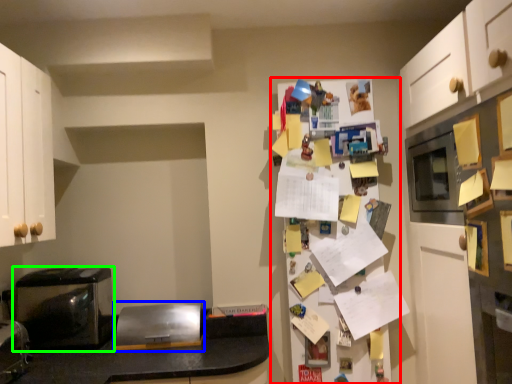
Question: Which object is the closest to the fridge (highlighted by a red box)? Choose among these: appliance (highlighted by a blue box) or home appliance (highlighted by a green box).

Choices:
 (A) appliance
 (B) home appliance

Answer: (A)